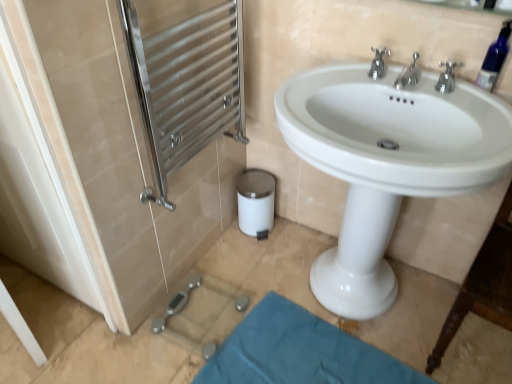
Question: Can you confirm if polished chrome faucet at upper center, which appears as the 2th tap when viewed from the right, is bigger than teal fabric bath mat at lower center?

Choices:
 (A) no
 (B) yes

Answer: (A)

Question: Is polished chrome faucet at upper center, which appears as the 2th tap when viewed from the right, further to the viewer compared to teal fabric bath mat at lower center?

Choices:
 (A) yes
 (B) no

Answer: (B)

Question: Is polished chrome faucet at upper center, the 2th tap positioned from the left, with teal fabric bath mat at lower center?

Choices:
 (A) yes
 (B) no

Answer: (B)

Question: Can you confirm if polished chrome faucet at upper center, which appears as the 2th tap when viewed from the right, is positioned to the right of teal fabric bath mat at lower center?

Choices:
 (A) yes
 (B) no

Answer: (A)

Question: Can you confirm if polished chrome faucet at upper center, which appears as the 2th tap when viewed from the right, is smaller than teal fabric bath mat at lower center?

Choices:
 (A) yes
 (B) no

Answer: (A)

Question: From the image's perspective, is polished chrome faucet at upper center, the first tap from the left, located above or below transparent plastic bottle at upper right?

Choices:
 (A) above
 (B) below

Answer: (A)

Question: Based on their sizes in the image, would you say polished chrome faucet at upper center, the first tap from the left, is bigger or smaller than transparent plastic bottle at upper right?

Choices:
 (A) small
 (B) big

Answer: (B)

Question: Is polished chrome faucet at upper center, the first tap from the left, inside the boundaries of transparent plastic bottle at upper right, or outside?

Choices:
 (A) outside
 (B) inside

Answer: (A)

Question: From a real-world perspective, is polished chrome faucet at upper center, the third tap when ordered from right to left, physically located above or below transparent plastic bottle at upper right?

Choices:
 (A) below
 (B) above

Answer: (A)

Question: Is polished chrome faucet at upper center, the third tap when ordered from right to left, spatially inside polished chrome faucet at upper center, the 2th tap positioned from the left, or outside of it?

Choices:
 (A) outside
 (B) inside

Answer: (A)

Question: From the image's perspective, is polished chrome faucet at upper center, the first tap from the left, located above or below polished chrome faucet at upper center, the 2th tap positioned from the left?

Choices:
 (A) above
 (B) below

Answer: (A)

Question: From a real-world perspective, relative to polished chrome faucet at upper center, which appears as the 2th tap when viewed from the right, is polished chrome faucet at upper center, the first tap from the left, vertically above or below?

Choices:
 (A) above
 (B) below

Answer: (A)

Question: Considering the positions of point (379, 69) and point (415, 72), is point (379, 69) closer or farther from the camera than point (415, 72)?

Choices:
 (A) closer
 (B) farther

Answer: (B)

Question: Would you say transparent plastic bottle at upper right is inside or outside white glossy screen door at left, which ranks as the first screen door in left-to-right order?

Choices:
 (A) outside
 (B) inside

Answer: (A)

Question: In terms of size, does transparent plastic bottle at upper right appear bigger or smaller than white glossy screen door at left, the 2th screen door when ordered from right to left?

Choices:
 (A) small
 (B) big

Answer: (A)